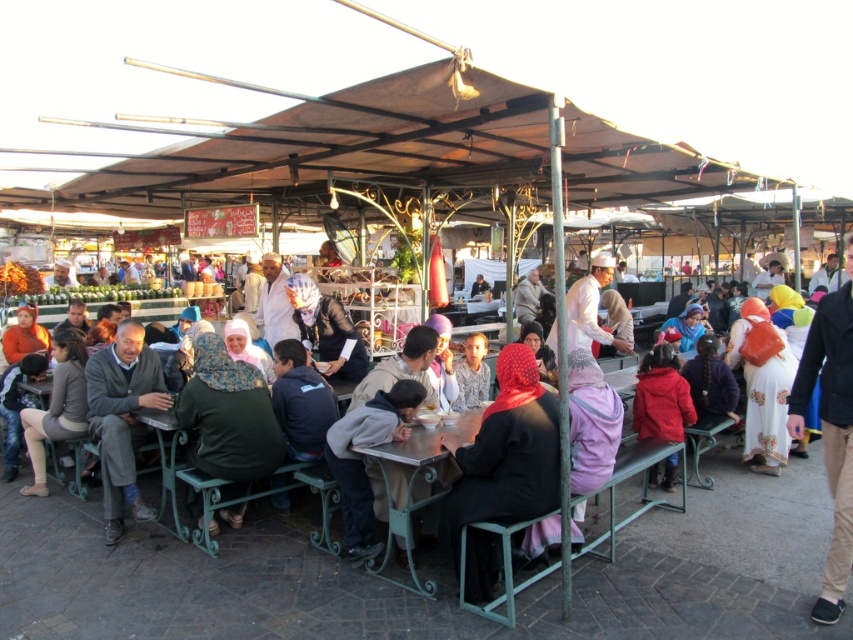
Question: Among these objects, which one is nearest to the camera?

Choices:
 (A) metallic green table at center
 (B) matte black helmet at center
 (C) black fabric headscarf at center
 (D) khaki cotton pants at right

Answer: (D)

Question: Is metallic green table at center positioned at the back of matte black helmet at center?

Choices:
 (A) no
 (B) yes

Answer: (A)

Question: Which of the following is the closest to the observer?

Choices:
 (A) (328, 353)
 (B) (358, 525)

Answer: (B)

Question: Can you confirm if black fabric headscarf at center is smaller than gray wool sweater at left?

Choices:
 (A) no
 (B) yes

Answer: (B)

Question: Which point is closer to the camera?

Choices:
 (A) khaki cotton pants at right
 (B) black fabric headscarf at center

Answer: (A)

Question: Does black fabric headscarf at center have a larger size compared to matte black helmet at center?

Choices:
 (A) yes
 (B) no

Answer: (B)